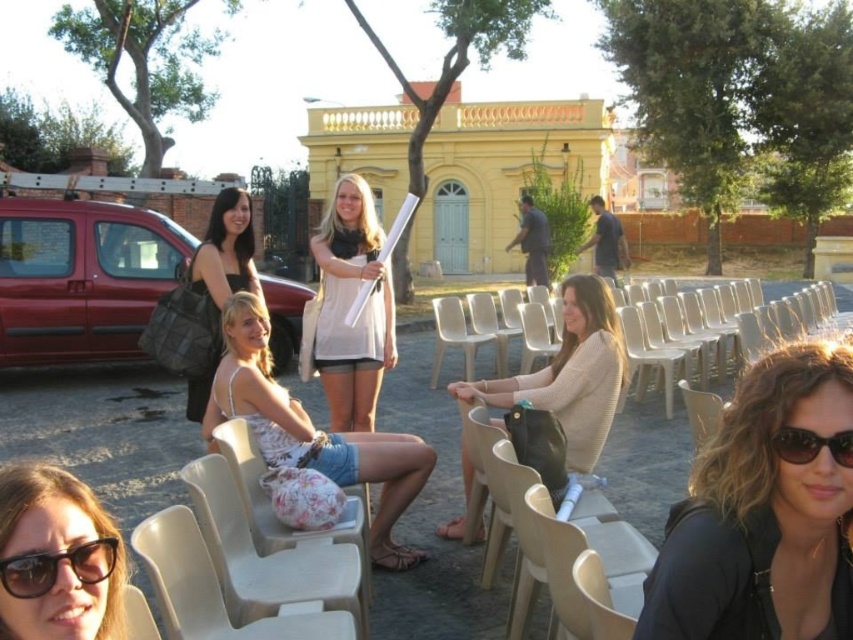
You are planning to place a small table between the denim shorts at center and the black plastic sunglasses at lower left. The table requires 5 meters of space. Is there enough space between them?

The denim shorts at center and the black plastic sunglasses at lower left are 4.85 meters apart from each other. Since the required space is 5 meters, there is not enough space to place the table between them.

You are standing at the center of the scene and want to pick up the black plastic sunglasses at lower right. Which direction should you move relative to the beige plastic chair at center?

The beige plastic chair at center is to the left of the black plastic sunglasses at lower right, so to reach the sunglasses, you should move to the right from the chair.